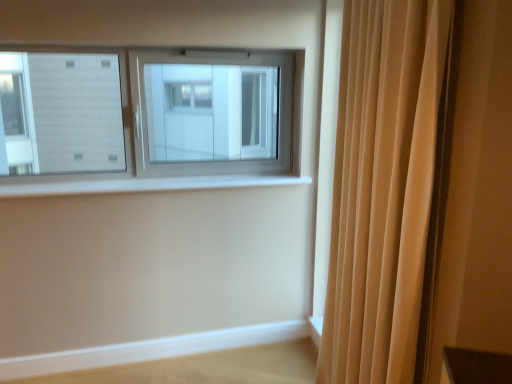
Question: From the image's perspective, is white smooth window sill at center located above or below beige fabric curtain at right?

Choices:
 (A) above
 (B) below

Answer: (A)

Question: From a real-world perspective, is white smooth window sill at center physically located above or below beige fabric curtain at right?

Choices:
 (A) below
 (B) above

Answer: (A)

Question: Which is nearer to the white smooth window sill at center?

Choices:
 (A) light wood ledge at lower right
 (B) beige fabric curtain at right

Answer: (A)

Question: Which of these objects is positioned closest to the beige fabric curtain at right?

Choices:
 (A) light wood ledge at lower right
 (B) white smooth window sill at center

Answer: (B)